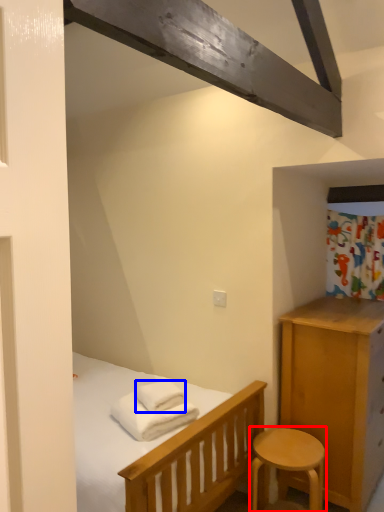
Question: Which point is further to the camera, stool (highlighted by a red box) or bath towel (highlighted by a blue box)?

Choices:
 (A) stool
 (B) bath towel

Answer: (B)